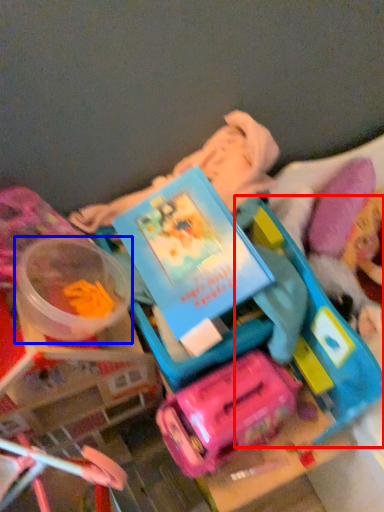
Question: Which object is closer to the camera taking this photo, toy (highlighted by a red box) or toy (highlighted by a blue box)?

Choices:
 (A) toy
 (B) toy

Answer: (A)